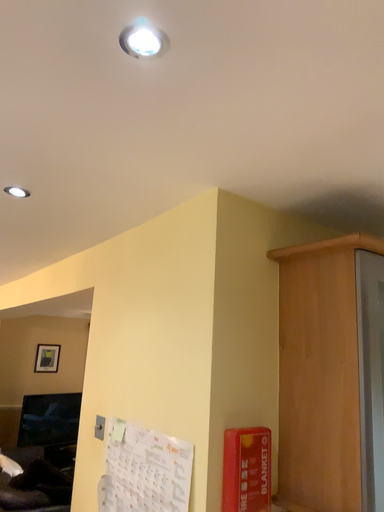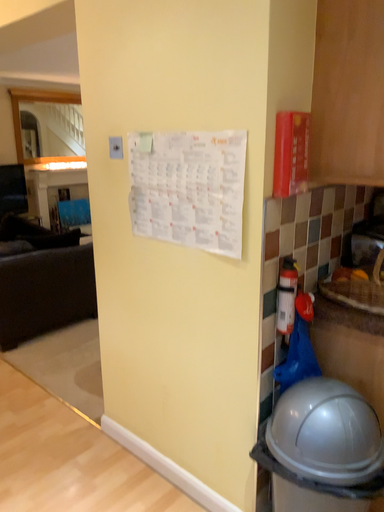
Question: How did the camera likely rotate when shooting the video?

Choices:
 (A) rotated downward
 (B) rotated upward

Answer: (A)